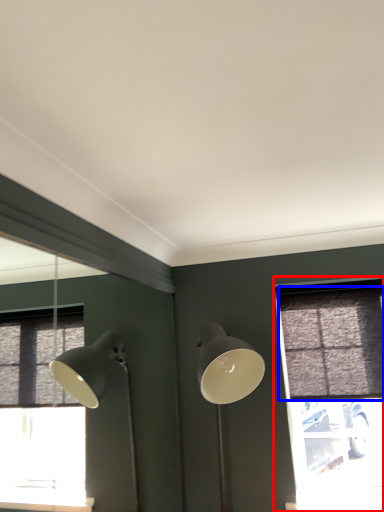
Question: Which object appears farthest to the camera in this image, window (highlighted by a red box) or curtain (highlighted by a blue box)?

Choices:
 (A) window
 (B) curtain

Answer: (A)